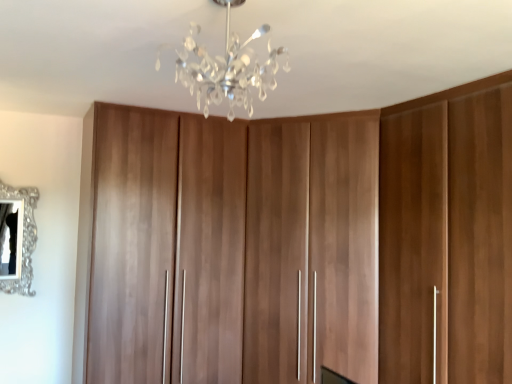
Question: From a real-world perspective, is silver ornate mirror at left beneath walnut wood cupboard at center?

Choices:
 (A) yes
 (B) no

Answer: (B)

Question: Is walnut wood cupboard at center inside silver ornate mirror at left?

Choices:
 (A) yes
 (B) no

Answer: (B)

Question: From a real-world perspective, does silver ornate mirror at left stand above walnut wood cupboard at center?

Choices:
 (A) yes
 (B) no

Answer: (A)

Question: Considering the relative sizes of silver ornate mirror at left and walnut wood cupboard at center in the image provided, is silver ornate mirror at left shorter than walnut wood cupboard at center?

Choices:
 (A) yes
 (B) no

Answer: (A)

Question: Is silver ornate mirror at left with walnut wood cupboard at center?

Choices:
 (A) yes
 (B) no

Answer: (B)

Question: In terms of width, does silver ornate mirror at left look wider or thinner when compared to clear crystal chandelier at upper center?

Choices:
 (A) wide
 (B) thin

Answer: (B)

Question: Is point (27, 208) closer or farther from the camera than point (216, 0)?

Choices:
 (A) farther
 (B) closer

Answer: (A)

Question: From the image's perspective, is silver ornate mirror at left above or below clear crystal chandelier at upper center?

Choices:
 (A) below
 (B) above

Answer: (A)

Question: Considering their positions, is silver ornate mirror at left located in front of or behind clear crystal chandelier at upper center?

Choices:
 (A) front
 (B) behind

Answer: (B)

Question: Based on their sizes in the image, would you say walnut wood cupboard at center is bigger or smaller than silver ornate mirror at left?

Choices:
 (A) small
 (B) big

Answer: (B)

Question: Is walnut wood cupboard at center spatially inside silver ornate mirror at left, or outside of it?

Choices:
 (A) outside
 (B) inside

Answer: (A)

Question: Is point (475, 364) positioned closer to the camera than point (0, 190)?

Choices:
 (A) farther
 (B) closer

Answer: (B)

Question: Considering their positions, is walnut wood cupboard at center located in front of or behind silver ornate mirror at left?

Choices:
 (A) front
 (B) behind

Answer: (A)

Question: From the image's perspective, is clear crystal chandelier at upper center located above or below silver ornate mirror at left?

Choices:
 (A) below
 (B) above

Answer: (B)

Question: Considering the relative positions of clear crystal chandelier at upper center and silver ornate mirror at left in the image provided, is clear crystal chandelier at upper center to the left or to the right of silver ornate mirror at left?

Choices:
 (A) left
 (B) right

Answer: (B)